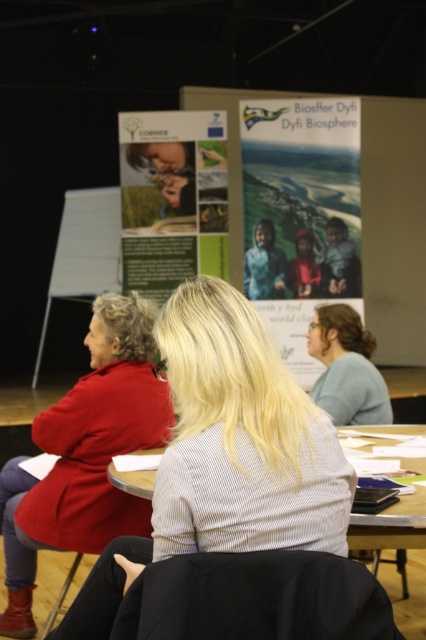
You are a photographer trying to capture a clear shot of the green paper poster at center and the wooden table at center. Which object should you focus on first if you want to ensure both are in focus without adjusting your camera settings?

The green paper poster at center is further to the viewer than the wooden table at center. To ensure both are in focus, you should focus on the green paper poster at center first, as it is closer to the camera, and the wooden table at center will naturally fall into the depth of field if the focus is set correctly on the closer object.

You are organizing a presentation and need to know if the green paper poster at center can be placed on the wooden table at center without overhanging the edges. Based on the scene description, will the poster fit entirely on the table?

The green paper poster at center is wider than the wooden table at center, so it will overhang the edges and not fit entirely.